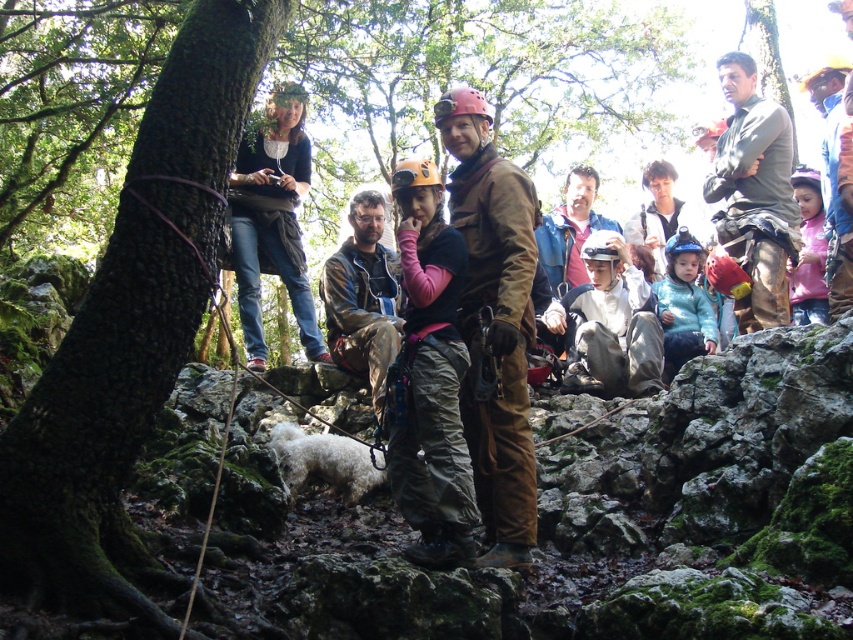
I want to click on camouflage jacket at center, so [x=363, y=298].

Measure the distance between point (364, 369) and camera.

Point (364, 369) and camera are 21.80 meters apart from each other.

Identify the location of camouflage jacket at center. This screenshot has width=853, height=640. (363, 298).

Where is `camouflage jacket at center`? camouflage jacket at center is located at coordinates (363, 298).

Does point (44, 372) lie in front of point (521, 541)?

Yes, it is in front of point (521, 541).

Is green rough bark tree at upper left taller than brown suede jacket at center?

No, green rough bark tree at upper left is not taller than brown suede jacket at center.

What do you see at coordinates (131, 330) in the screenshot?
I see `green rough bark tree at upper left` at bounding box center [131, 330].

Where is `green rough bark tree at upper left`? This screenshot has height=640, width=853. green rough bark tree at upper left is located at coordinates (131, 330).

Can you confirm if denim jeans at upper left is positioned below matte brown helmet at center?

Incorrect, denim jeans at upper left is not positioned below matte brown helmet at center.

Does denim jeans at upper left have a lesser height compared to matte brown helmet at center?

Incorrect, denim jeans at upper left's height does not fall short of matte brown helmet at center's.

Which is in front, point (311, 308) or point (567, 192)?

Point (311, 308)

Find the location of a particular element. denim jeans at upper left is located at coordinates (271, 220).